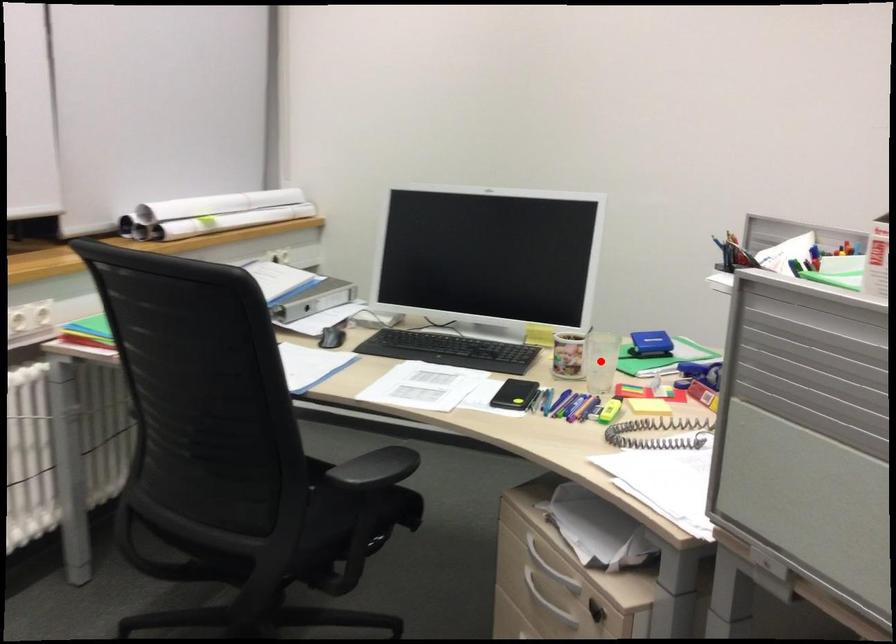
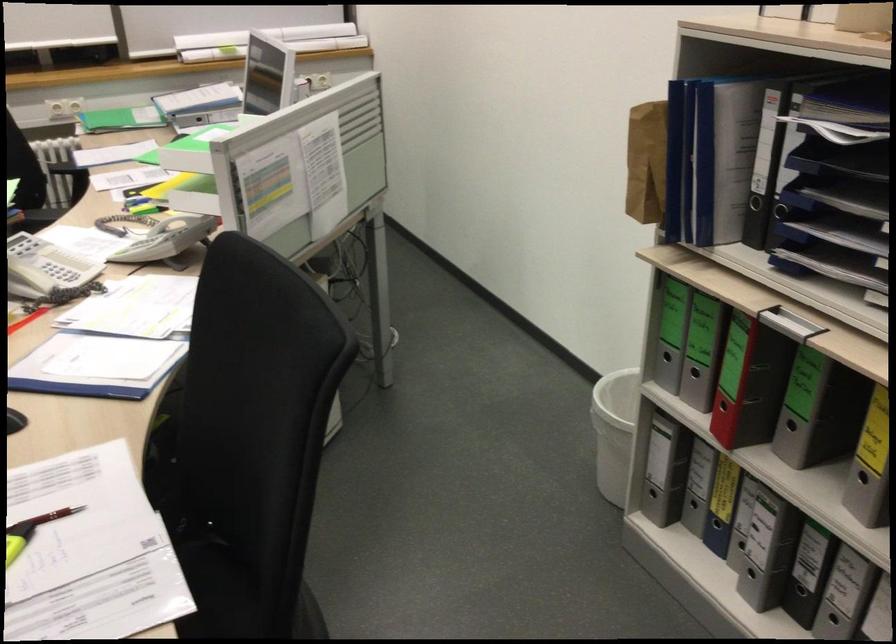
Question: I am providing you with two images of the same scene from different viewpoints. A red point is marked on the first image. Is the red point's position out of view in image 2?

Choices:
 (A) Yes
 (B) No

Answer: (A)